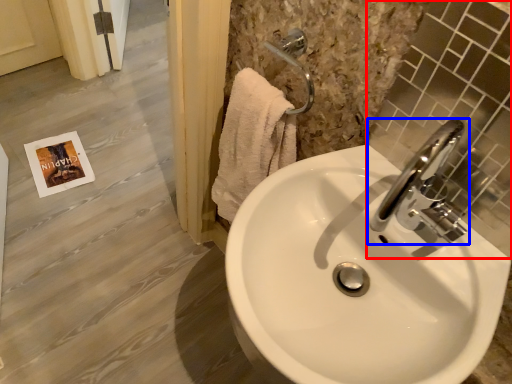
Question: Among these objects, which one is farthest to the camera, mirror (highlighted by a red box) or tap (highlighted by a blue box)?

Choices:
 (A) mirror
 (B) tap

Answer: (B)